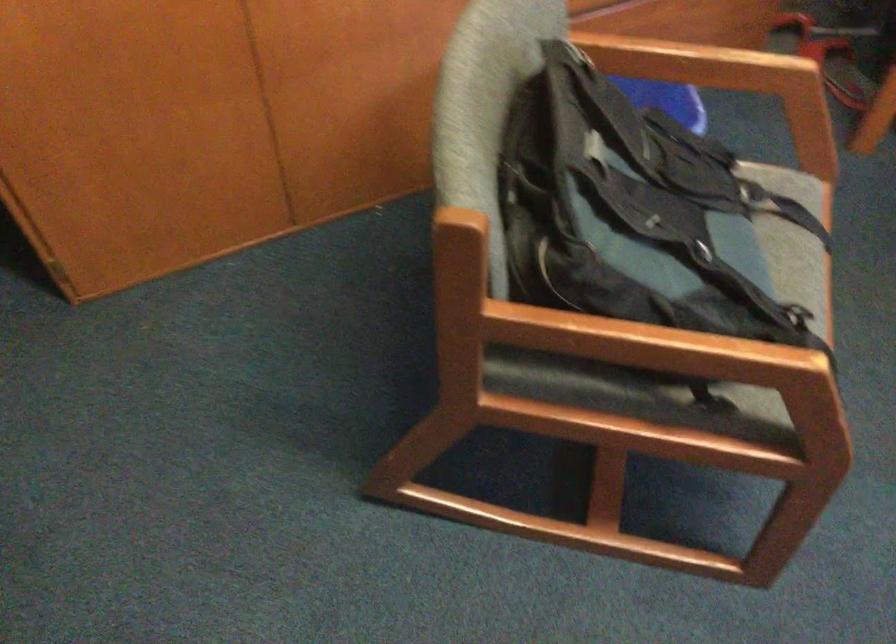
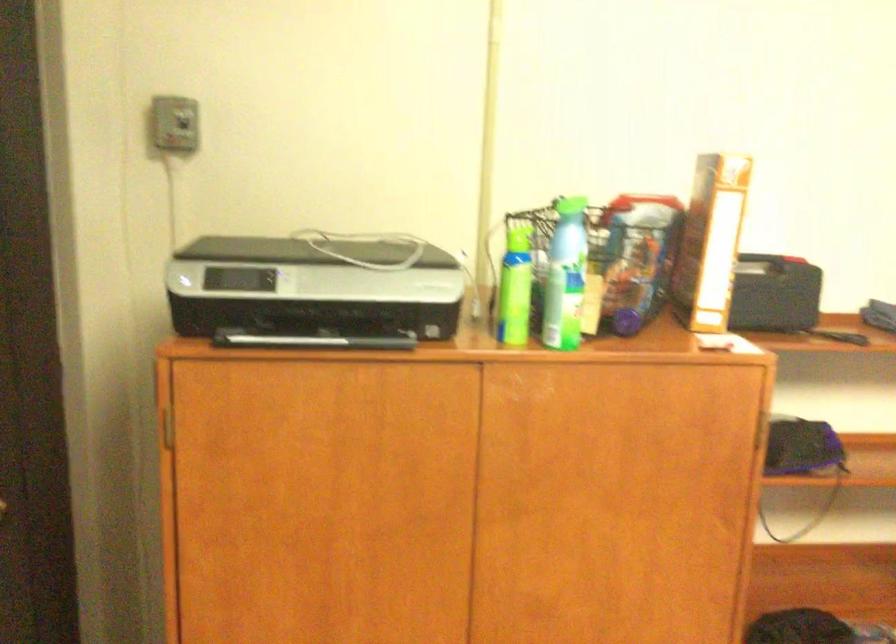
The images are taken continuously from a first-person perspective. In which direction is your viewpoint rotating?

The camera's rotation is toward left-up.